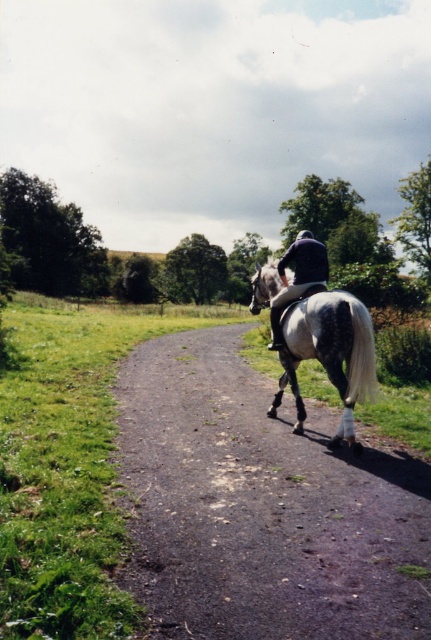
Question: Is gray/white horse at center thinner than gray speckled horse at center?

Choices:
 (A) no
 (B) yes

Answer: (A)

Question: Which object appears farthest from the camera in this image?

Choices:
 (A) gray speckled horse at center
 (B) gray/white horse at center

Answer: (A)

Question: Among these objects, which one is farthest from the camera?

Choices:
 (A) gray speckled horse at center
 (B) gray/white horse at center

Answer: (A)

Question: Does gray/white horse at center have a greater width compared to gray speckled horse at center?

Choices:
 (A) yes
 (B) no

Answer: (A)

Question: Does gray/white horse at center have a larger size compared to gray speckled horse at center?

Choices:
 (A) yes
 (B) no

Answer: (A)

Question: Which point is farther from the camera taking this photo?

Choices:
 (A) (265, 589)
 (B) (347, 372)

Answer: (B)